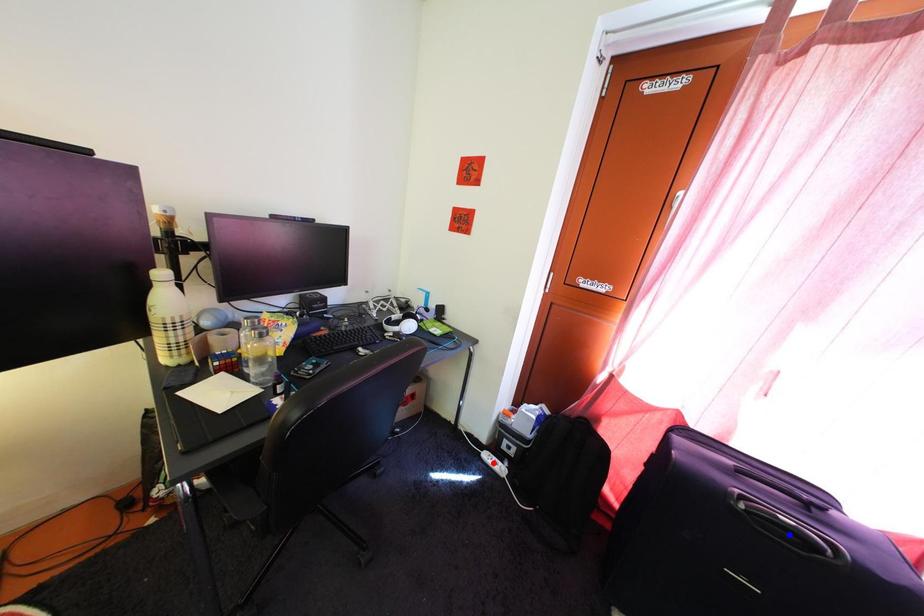
Question: Which of the two points in the image is closer to the camera?

Choices:
 (A) Blue point is closer.
 (B) Red point is closer.

Answer: (A)